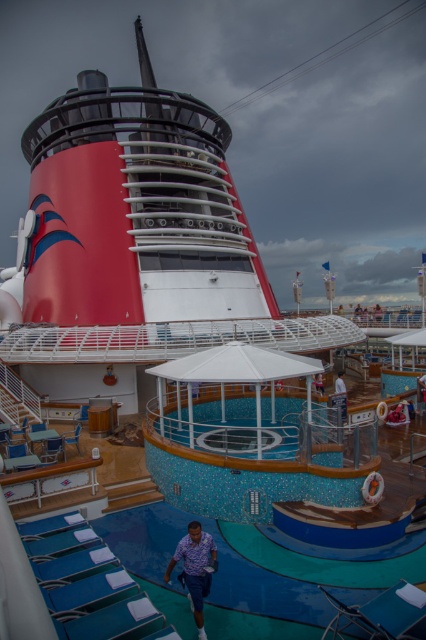
Question: Can you confirm if blue mosaic tiles at center is smaller than printed cotton shirt at lower center?

Choices:
 (A) yes
 (B) no

Answer: (B)

Question: Which point appears closest to the camera in this image?

Choices:
 (A) pyautogui.click(x=316, y=388)
 (B) pyautogui.click(x=199, y=552)

Answer: (B)

Question: Which object is the closest to the printed cotton shirt at lower center?

Choices:
 (A) white fabric umbrella at upper center
 (B) blue fabric shorts at lower center

Answer: (A)

Question: Among these objects, which one is nearest to the camera?

Choices:
 (A) blue mosaic tiles at center
 (B) printed cotton shirt at lower center
 (C) blue fabric shorts at lower center
 (D) white fabric umbrella at upper center

Answer: (B)

Question: Does blue mosaic tiles at center lie behind blue fabric shorts at lower center?

Choices:
 (A) no
 (B) yes

Answer: (A)

Question: Where is blue fabric shorts at lower center located in relation to white fabric umbrella at upper center in the image?

Choices:
 (A) right
 (B) left

Answer: (A)